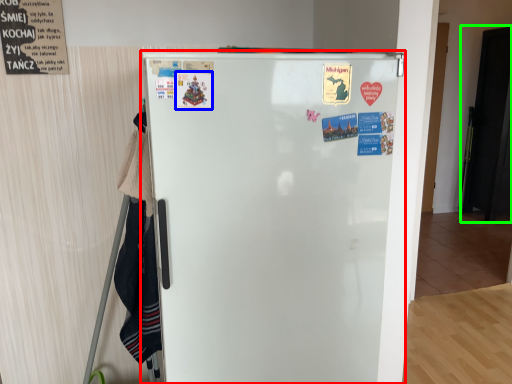
Question: Which is nearer to the refrigerator (highlighted by a red box)? poster (highlighted by a blue box) or door (highlighted by a green box).

Choices:
 (A) poster
 (B) door

Answer: (A)